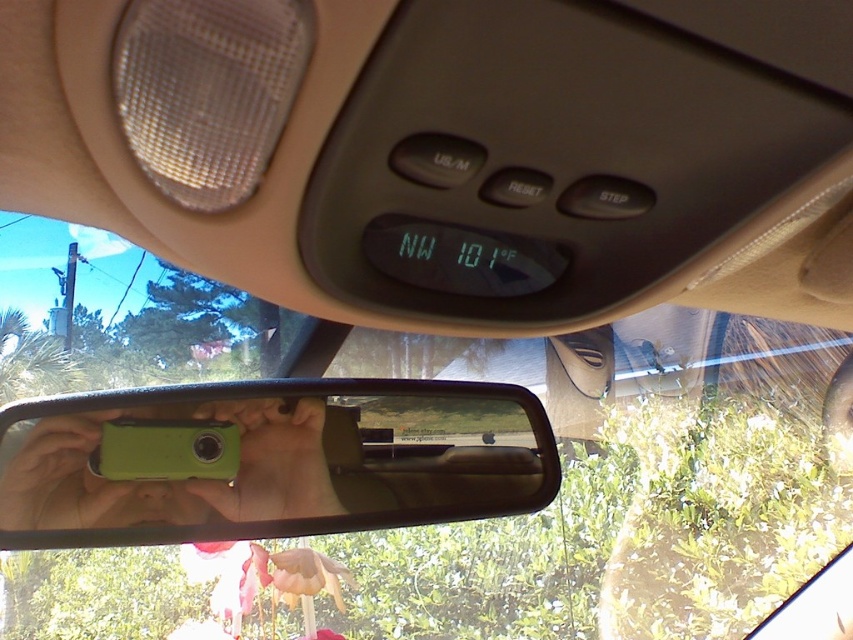
The height and width of the screenshot is (640, 853). I want to click on green plastic phone at center, so click(x=268, y=460).

Is green plastic phone at center thinner than green matte phone at center?

No.

Is point (107, 497) positioned before point (318, 504)?

That is True.

The image size is (853, 640). Find the location of `green plastic phone at center`. green plastic phone at center is located at coordinates (268, 460).